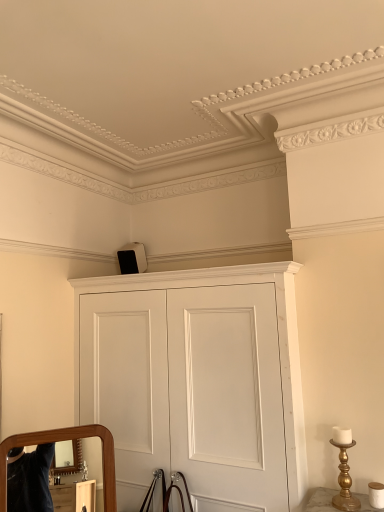
Question: From a real-world perspective, is white matte cupboard at upper center under gold metallic candlestick at lower right?

Choices:
 (A) yes
 (B) no

Answer: (B)

Question: Is white matte cupboard at upper center facing towards gold metallic candlestick at lower right?

Choices:
 (A) yes
 (B) no

Answer: (B)

Question: Is gold metallic candlestick at lower right completely or partially inside white matte cupboard at upper center?

Choices:
 (A) yes
 (B) no

Answer: (B)

Question: Considering the relative sizes of white matte cupboard at upper center and gold metallic candlestick at lower right in the image provided, is white matte cupboard at upper center wider than gold metallic candlestick at lower right?

Choices:
 (A) yes
 (B) no

Answer: (A)

Question: Is white matte cupboard at upper center positioned far away from gold metallic candlestick at lower right?

Choices:
 (A) yes
 (B) no

Answer: (B)

Question: Does white matte cupboard at upper center have a lesser width compared to gold metallic candlestick at lower right?

Choices:
 (A) no
 (B) yes

Answer: (A)

Question: Is gold metallic candlestick at lower right positioned behind white matte cupboard at upper center?

Choices:
 (A) yes
 (B) no

Answer: (A)

Question: From the image's perspective, is gold metallic candlestick at lower right located above white matte cupboard at upper center?

Choices:
 (A) yes
 (B) no

Answer: (B)

Question: Would you say gold metallic candlestick at lower right contains white matte cupboard at upper center?

Choices:
 (A) yes
 (B) no

Answer: (B)

Question: Can you confirm if gold metallic candlestick at lower right is wider than white matte cupboard at upper center?

Choices:
 (A) no
 (B) yes

Answer: (A)

Question: Can we say gold metallic candlestick at lower right lies outside white matte cupboard at upper center?

Choices:
 (A) no
 (B) yes

Answer: (B)

Question: From a real-world perspective, is gold metallic candlestick at lower right positioned under white matte cupboard at upper center based on gravity?

Choices:
 (A) no
 (B) yes

Answer: (B)

Question: Is white matte cupboard at upper center to the left or to the right of gold metallic candlestick at lower right in the image?

Choices:
 (A) right
 (B) left

Answer: (B)